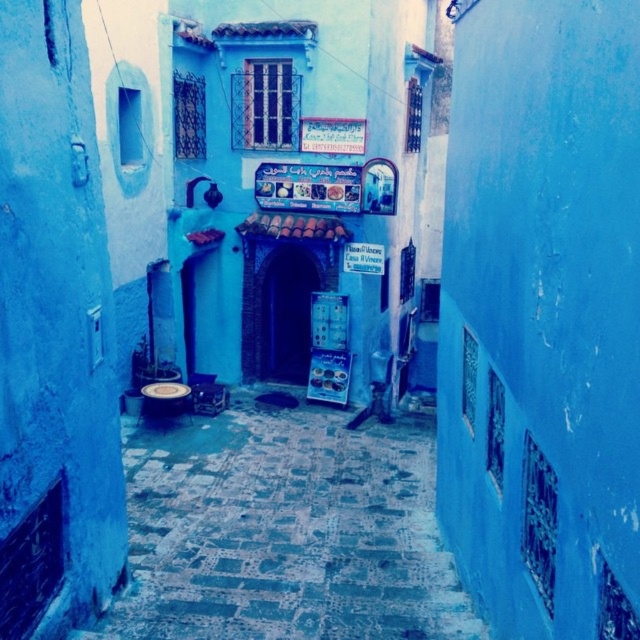
Can you confirm if smooth cobblestone alley at center is positioned above wooden stool at center?

Actually, smooth cobblestone alley at center is below wooden stool at center.

Does smooth cobblestone alley at center have a smaller size compared to wooden stool at center?

Yes, smooth cobblestone alley at center is smaller than wooden stool at center.

Find the location of `smooth cobblestone alley at center`. smooth cobblestone alley at center is located at coordinates (284, 531).